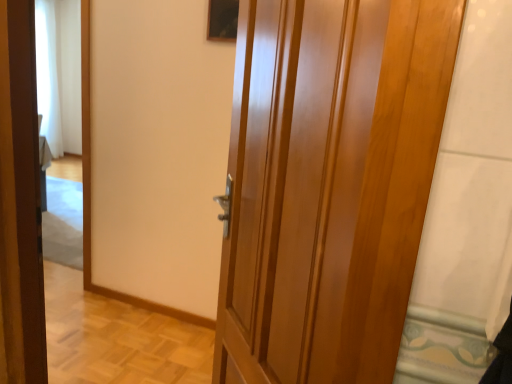
Image resolution: width=512 pixels, height=384 pixels. Find the location of `glossy wood door at center`. glossy wood door at center is located at coordinates (329, 184).

What do you see at coordinates (329, 184) in the screenshot? The width and height of the screenshot is (512, 384). I see `glossy wood door at center` at bounding box center [329, 184].

This screenshot has height=384, width=512. Identify the location of glossy wood door at center. (329, 184).